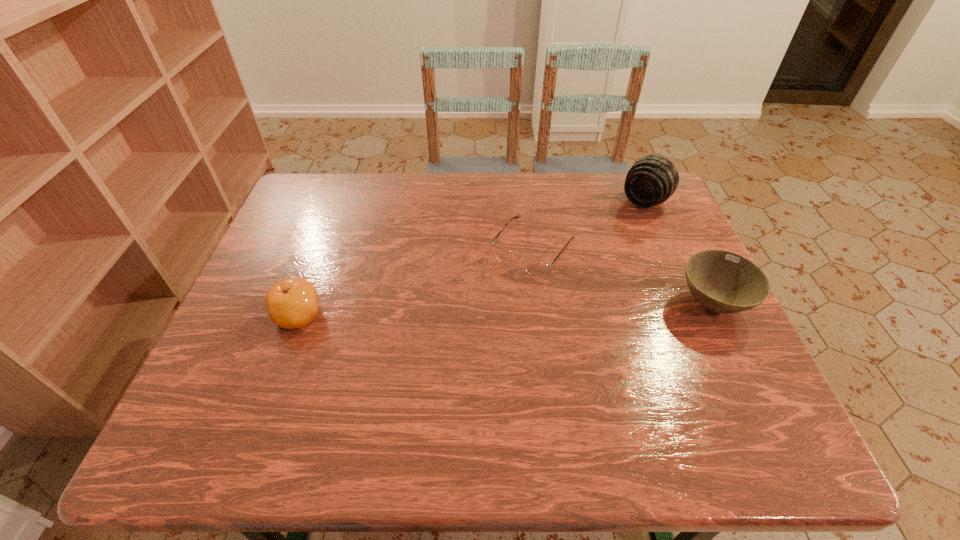
At what (x,y) coordinates should I click in order to perform the action: click on free area in between the shortest object and the clementine. Please return your answer as a coordinate pair (x, y). This screenshot has width=960, height=540. Looking at the image, I should click on (416, 283).

Identify the location of free space between the bowl and the clementine. The height and width of the screenshot is (540, 960). (505, 309).

Identify the location of empty space between the telephoto lens and the shortest object. The width and height of the screenshot is (960, 540). (588, 226).

This screenshot has width=960, height=540. Identify the location of vacant area that lies between the bowl and the spectacles. (622, 277).

The height and width of the screenshot is (540, 960). In order to click on free point between the clementine and the telephoto lens in this screenshot , I will do click(471, 259).

Locate an element on the screen. The height and width of the screenshot is (540, 960). free spot between the telephoto lens and the bowl is located at coordinates (679, 253).

Find the location of a particular element. the closest object to the bowl is located at coordinates (534, 267).

Identify which object is the closest to the shortest object. Please provide its 2D coordinates. Your answer should be formatted as a tuple, i.e. [(x, y)], where the tuple contains the x and y coordinates of a point satisfying the conditions above.

[(653, 179)]

I want to click on free point that satisfies the following two spatial constraints: 1. on the front side of the telephoto lens; 2. on the left side of the bowl, so click(x=688, y=303).

This screenshot has width=960, height=540. Identify the location of free space that satisfies the following two spatial constraints: 1. on the front side of the spectacles; 2. on the left side of the bowl. (540, 303).